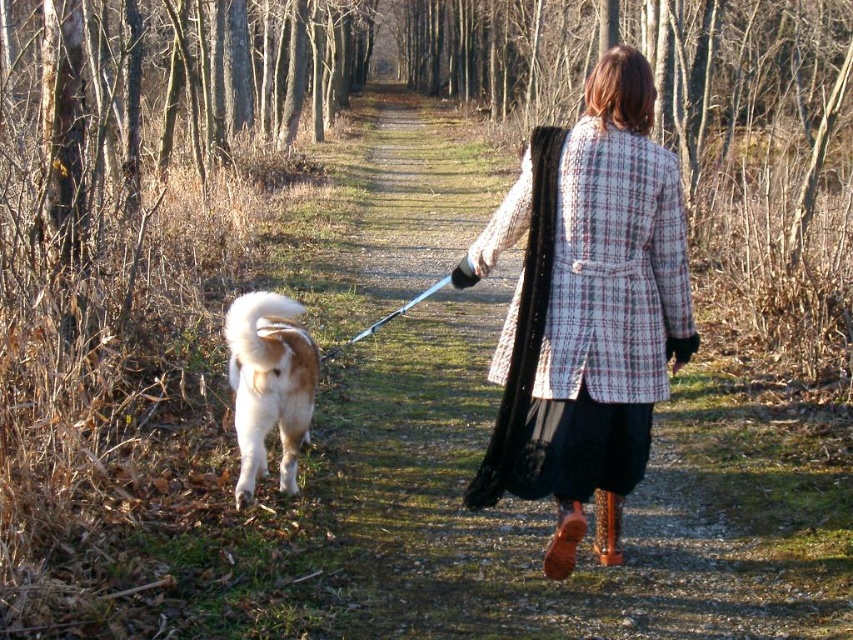
Is gravel path at center further to the viewer compared to fluffy white fur at lower left?

No.

Which is more to the right, gravel path at center or fluffy white fur at lower left?

fluffy white fur at lower left is more to the right.

Between point (730, 620) and point (242, 337), which one is positioned behind?

Point (242, 337)

This screenshot has height=640, width=853. Identify the location of gravel path at center. 552,509.

Is gravel path at center smaller than plaid wool coat at center?

Incorrect, gravel path at center is not smaller in size than plaid wool coat at center.

From the picture: Is gravel path at center bigger than plaid wool coat at center?

Yes, gravel path at center is bigger than plaid wool coat at center.

Who is more distant from viewer, (427,192) or (622,116)?

Point (427,192)

You are a GUI agent. You are given a task and a screenshot of the screen. Output one action in this format:
    pyautogui.click(x=<x>, y=<y>)
    Task: Click on the gravel path at center
    The height and width of the screenshot is (640, 853).
    Given the screenshot: What is the action you would take?
    coord(552,509)

Which is more to the right, plaid wool coat at center or fluffy white fur at lower left?

Positioned to the right is plaid wool coat at center.

Does plaid wool coat at center appear over fluffy white fur at lower left?

Yes, plaid wool coat at center is above fluffy white fur at lower left.

Who is more forward, (x=619, y=328) or (x=299, y=348)?

Positioned in front is point (x=619, y=328).

Find the location of `plaid wool coat at center`. plaid wool coat at center is located at coordinates (585, 310).